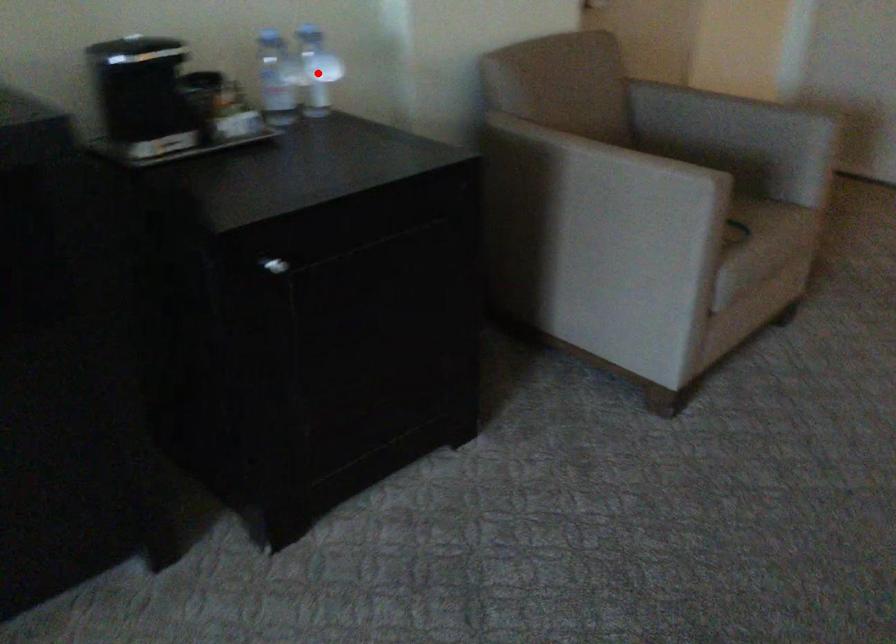
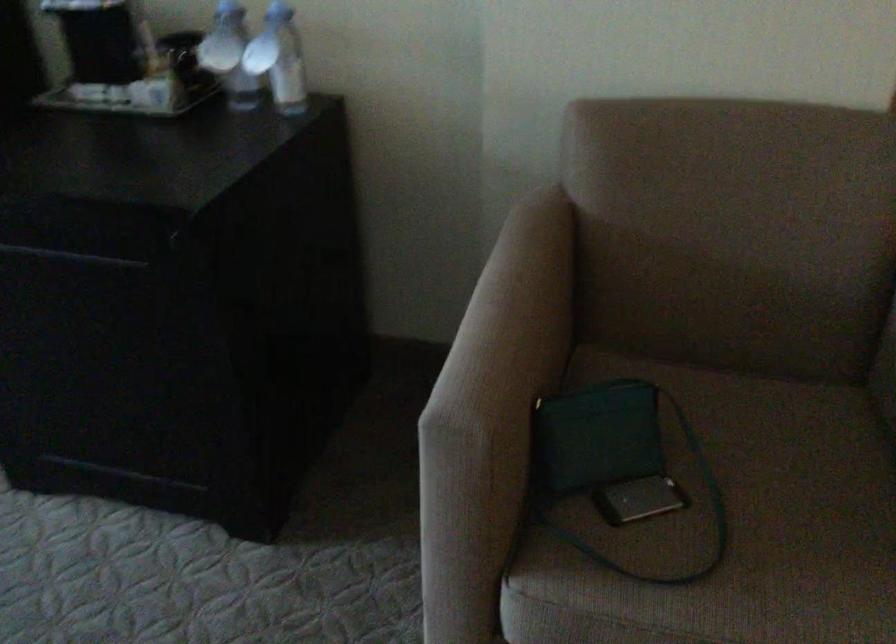
Question: I am providing you with two images of the same scene from different viewpoints. Image1 has a red point marked. In image2, the corresponding 3D location appears at what relative position? Reply with the corresponding letter.

Choices:
 (A) Closer
 (B) Farther

Answer: (A)